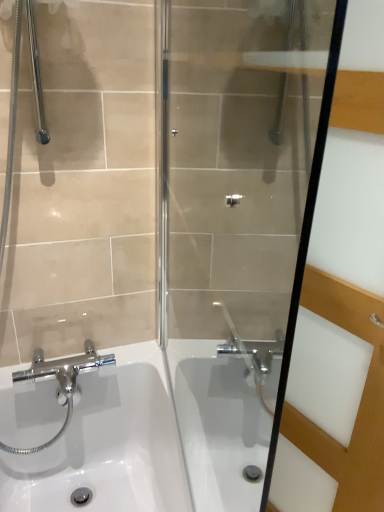
Question: Is transparent glass screen door at center completely or partially inside white glossy sink at lower left?

Choices:
 (A) no
 (B) yes

Answer: (A)

Question: Is white glossy sink at lower left touching transparent glass screen door at center?

Choices:
 (A) yes
 (B) no

Answer: (B)

Question: Does white glossy sink at lower left have a larger size compared to transparent glass screen door at center?

Choices:
 (A) no
 (B) yes

Answer: (B)

Question: Is white glossy sink at lower left outside transparent glass screen door at center?

Choices:
 (A) no
 (B) yes

Answer: (B)

Question: Is white glossy sink at lower left taller than transparent glass screen door at center?

Choices:
 (A) no
 (B) yes

Answer: (A)

Question: Is white glossy sink at lower left behind transparent glass screen door at center?

Choices:
 (A) yes
 (B) no

Answer: (A)

Question: Considering the relative positions of transparent glass screen door at center and transparent glass shower door at center in the image provided, is transparent glass screen door at center to the right of transparent glass shower door at center from the viewer's perspective?

Choices:
 (A) no
 (B) yes

Answer: (B)

Question: Can you see transparent glass screen door at center touching transparent glass shower door at center?

Choices:
 (A) no
 (B) yes

Answer: (A)

Question: From the image's perspective, is transparent glass screen door at center located beneath transparent glass shower door at center?

Choices:
 (A) no
 (B) yes

Answer: (B)

Question: Can transparent glass shower door at center be found inside transparent glass screen door at center?

Choices:
 (A) no
 (B) yes

Answer: (A)

Question: Can you confirm if transparent glass screen door at center is shorter than transparent glass shower door at center?

Choices:
 (A) no
 (B) yes

Answer: (A)

Question: Is transparent glass screen door at center facing towards transparent glass shower door at center?

Choices:
 (A) yes
 (B) no

Answer: (A)

Question: From a real-world perspective, is white glossy sink at lower left positioned under transparent glass shower door at center based on gravity?

Choices:
 (A) yes
 (B) no

Answer: (A)